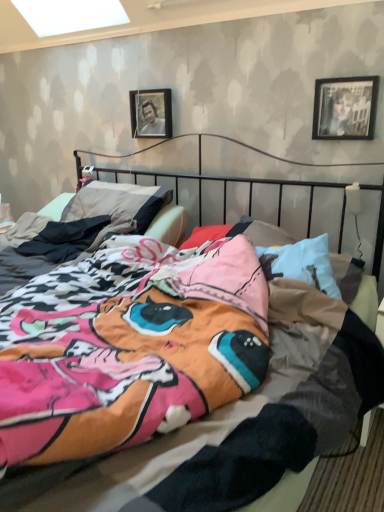
Question: Would you say wooden frame at upper center, acting as the 1th picture frame starting from the left, is inside or outside black glossy photo frame at upper right, the first picture frame when ordered from front to back?

Choices:
 (A) outside
 (B) inside

Answer: (A)

Question: Is wooden frame at upper center, positioned as the 1th picture frame in back-to-front order, in front of or behind black glossy photo frame at upper right, acting as the 2th picture frame starting from the back, in the image?

Choices:
 (A) front
 (B) behind

Answer: (B)

Question: In terms of width, does wooden frame at upper center, positioned as the 1th picture frame in back-to-front order, look wider or thinner when compared to black glossy photo frame at upper right, the first picture frame when ordered from front to back?

Choices:
 (A) thin
 (B) wide

Answer: (B)

Question: From their relative heights in the image, would you say black glossy photo frame at upper right, the first picture frame when ordered from front to back, is taller or shorter than wooden frame at upper center, positioned as the 1th picture frame in back-to-front order?

Choices:
 (A) short
 (B) tall

Answer: (B)

Question: From a real-world perspective, is black glossy photo frame at upper right, placed as the 1th picture frame when sorted from right to left, above or below wooden frame at upper center, acting as the 1th picture frame starting from the left?

Choices:
 (A) above
 (B) below

Answer: (A)

Question: Would you say black glossy photo frame at upper right, the 2th picture frame from the left, is inside or outside wooden frame at upper center, acting as the 1th picture frame starting from the left?

Choices:
 (A) inside
 (B) outside

Answer: (B)

Question: Is point (329, 115) closer or farther from the camera than point (152, 110)?

Choices:
 (A) closer
 (B) farther

Answer: (A)